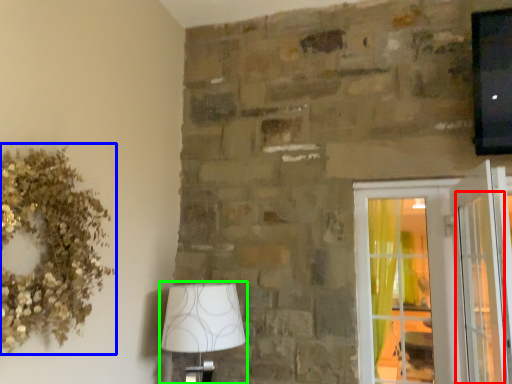
Question: Which is farther away from screen door (highlighted by a red box)? floral arrangement (highlighted by a blue box) or lamp (highlighted by a green box)?

Choices:
 (A) floral arrangement
 (B) lamp

Answer: (A)